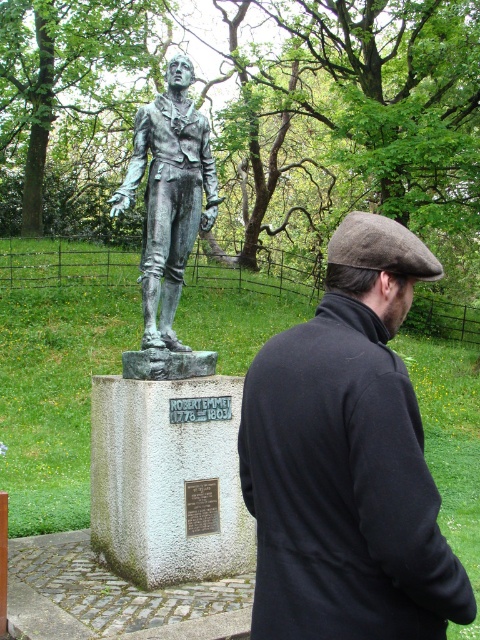
You are standing at the point labeled as point (335, 236) in the image. You want to take a photo of the statue of Robert Emmett. Can you see the entire statue from your current position?

The point labeled as point (335, 236) is 2.34 meters away from the viewer. Since the statue is on a pedestal and the point is at a distance, it is likely that the entire statue can be captured in the photo from this position.

Consider the image. You are a photographer standing at the base of the statue. You want to take a closeup shot of the dark brown woolen cap at center without moving the statue. What is the minimum distance you need to move forward to ensure the cap fills the frame?

The dark brown woolen cap at center is 1.81 meters away from the camera. To take a closeup shot, you need to move forward until you are within 1.81 meters to ensure the cap fills the frame.

You are standing in front of the bronze statue at center and notice a dark brown woolen cap at center. Which object is nearer to you?

The dark brown woolen cap at center is closer to the viewer than the bronze statue at center.